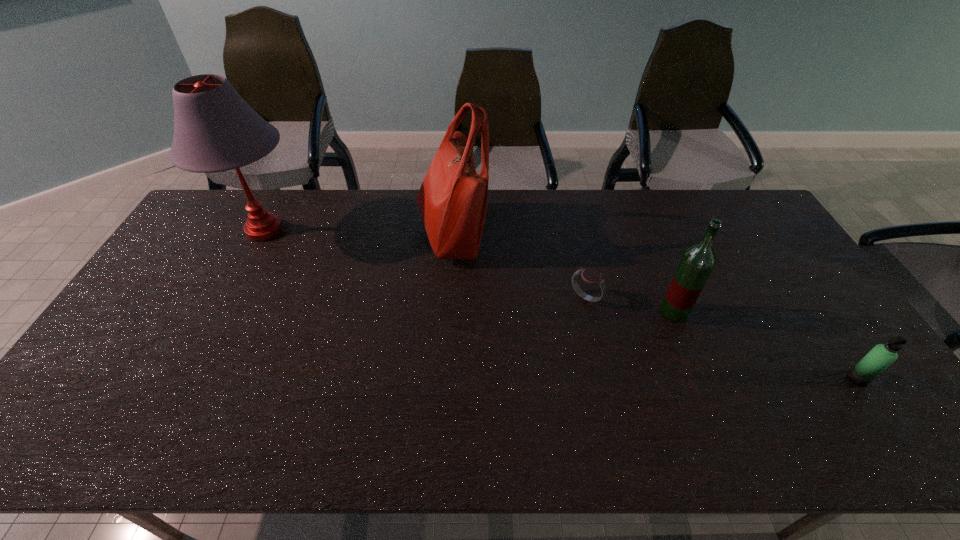
Identify the location of vacant region at the left edge. (146, 319).

In the image, there is a desktop. Where is `vacant space at the far right corner`? vacant space at the far right corner is located at coordinates (752, 217).

Image resolution: width=960 pixels, height=540 pixels. In order to click on free space between the table lamp and the thermos bottle in this screenshot , I will do `click(561, 305)`.

Where is `empty location between the leftmost object and the third object from right to left`? empty location between the leftmost object and the third object from right to left is located at coordinates (425, 264).

Find the location of a particular element. unoccupied position between the shortest object and the nearest object is located at coordinates (722, 338).

In order to click on vacant area that lies between the fourth object from right to left and the nearest object in this screenshot , I will do `click(655, 306)`.

Image resolution: width=960 pixels, height=540 pixels. Identify the location of free spot between the liquor and the nearest object. (765, 345).

You are a GUI agent. You are given a task and a screenshot of the screen. Output one action in this format:
    pyautogui.click(x=<x>, y=<y>)
    Task: Click on the vacant area between the table lamp and the fourth object from right to left
    The height and width of the screenshot is (540, 960).
    Given the screenshot: What is the action you would take?
    pyautogui.click(x=358, y=232)

The image size is (960, 540). What are the coordinates of `empty space between the leftmost object and the shortest object` in the screenshot? It's located at (425, 264).

Where is `free space between the third shortest object and the watch`? free space between the third shortest object and the watch is located at coordinates (x=630, y=305).